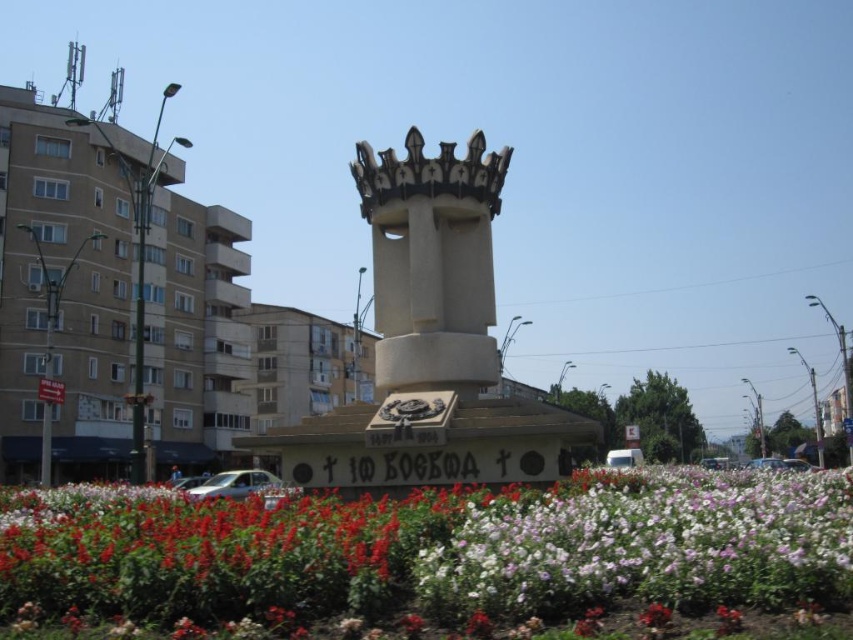
Question: Is white matte flowers at center positioned at the back of silver metallic car at lower center?

Choices:
 (A) no
 (B) yes

Answer: (A)

Question: Which point appears closest to the camera in this image?

Choices:
 (A) (65, 586)
 (B) (438, 289)
 (C) (424, 177)

Answer: (A)

Question: Considering the relative positions of white stone tower at center and white glossy car at center in the image provided, where is white stone tower at center located with respect to white glossy car at center?

Choices:
 (A) above
 (B) below

Answer: (A)

Question: Which is nearer to the white stone tower at center?

Choices:
 (A) white matte flowers at center
 (B) stone monument at center

Answer: (B)

Question: Can you confirm if white stone tower at center is bigger than silver metallic car at lower center?

Choices:
 (A) yes
 (B) no

Answer: (B)

Question: Which of the following is the farthest from the observer?

Choices:
 (A) white stone tower at center
 (B) silver metallic car at lower center
 (C) white matte flowers at center

Answer: (B)